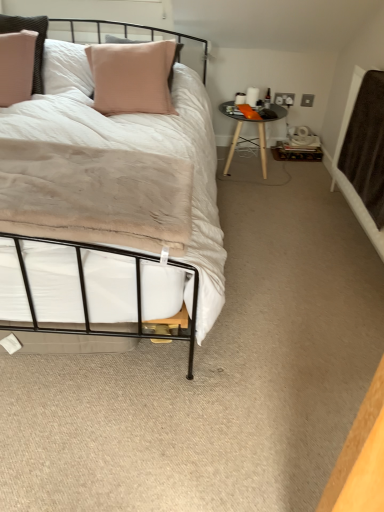
I want to click on vacant area situated below black glossy table at center right (from a real-world perspective), so [244, 170].